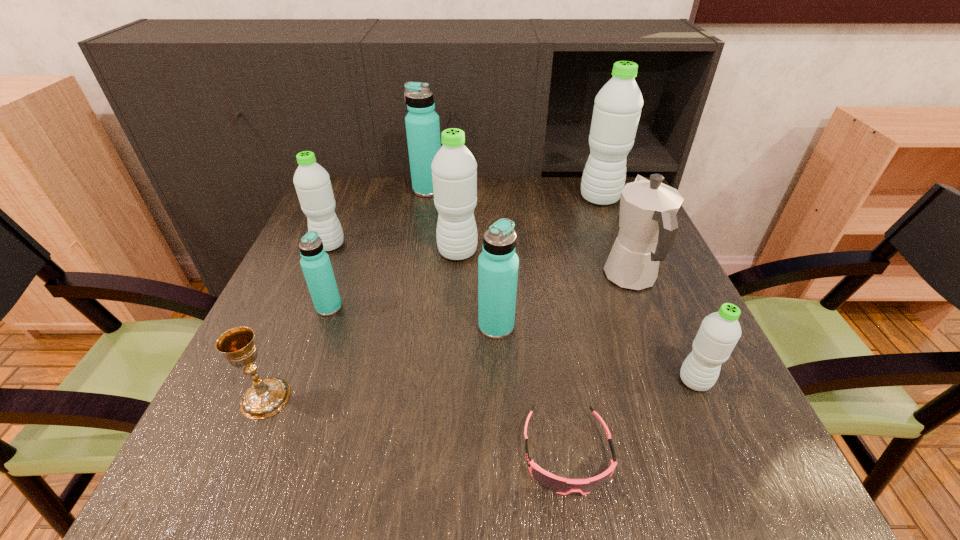
In the image, there is a desktop. Where is `vacant space at the near edge`? The height and width of the screenshot is (540, 960). vacant space at the near edge is located at coordinates (578, 471).

The image size is (960, 540). In the image, there is a desktop. Identify the location of vacant area at the left edge. (261, 320).

Image resolution: width=960 pixels, height=540 pixels. In the image, there is a desktop. Find the location of `vacant region at the right edge`. vacant region at the right edge is located at coordinates (610, 288).

What are the coordinates of `vacant space at the far left corner` in the screenshot? It's located at (371, 220).

This screenshot has height=540, width=960. I want to click on free space at the near left corner of the desktop, so click(x=219, y=458).

In the image, there is a desktop. In order to click on free region at the far right corner in this screenshot , I will do `click(611, 214)`.

Locate an element on the screen. free spot between the sixth object from right to left and the leftmost blue water bottle is located at coordinates [x=394, y=280].

At what (x,y) coordinates should I click in order to perform the action: click on free space between the third biggest green water bottle and the fifth object from left to right. Please return your answer as a coordinate pair (x, y). This screenshot has width=960, height=540. Looking at the image, I should click on (394, 249).

In order to click on vacant area that lies between the gray coffeepot and the biggest green water bottle in this screenshot , I will do `click(615, 238)`.

Where is `blank region between the fifth object from left to right and the chalice`? This screenshot has height=540, width=960. blank region between the fifth object from left to right and the chalice is located at coordinates (362, 325).